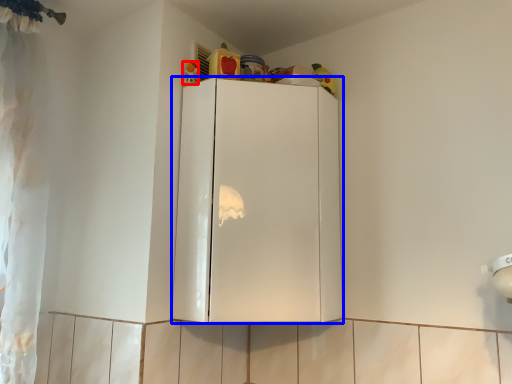
Question: Which of the following is the closest to the observer, toy (highlighted by a red box) or cabinetry (highlighted by a blue box)?

Choices:
 (A) toy
 (B) cabinetry

Answer: (B)